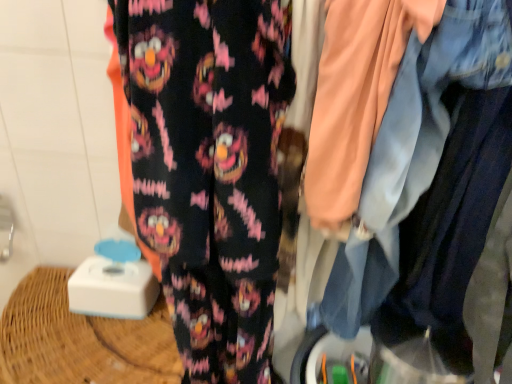
Locate an element on the screen. faded denim jacket at upper right is located at coordinates (413, 150).

What do you see at coordinates (413, 150) in the screenshot?
I see `faded denim jacket at upper right` at bounding box center [413, 150].

Identify the location of fluffy black pants at center. Image resolution: width=512 pixels, height=384 pixels. (209, 170).

What do you see at coordinates (209, 170) in the screenshot?
I see `fluffy black pants at center` at bounding box center [209, 170].

You are a GUI agent. You are given a task and a screenshot of the screen. Output one action in this format:
    pyautogui.click(x=<x>, y=<y>)
    Task: Click on the faded denim jacket at upper right
    Image resolution: width=512 pixels, height=384 pixels.
    Given the screenshot: What is the action you would take?
    pyautogui.click(x=413, y=150)

Considering the relative positions of fluffy black pants at center and faded denim jacket at upper right in the image provided, is fluffy black pants at center to the left of faded denim jacket at upper right from the viewer's perspective?

Yes.

Between fluffy black pants at center and faded denim jacket at upper right, which one is positioned in front?

faded denim jacket at upper right is closer to the camera.

Does point (190, 221) come behind point (393, 253)?

That is False.

In the scene shown: From the image's perspective, who appears lower, fluffy black pants at center or faded denim jacket at upper right?

fluffy black pants at center is shown below in the image.

From a real-world perspective, which is physically below, fluffy black pants at center or faded denim jacket at upper right?

fluffy black pants at center, from a real-world perspective.

Is fluffy black pants at center wider than faded denim jacket at upper right?

No.

In terms of height, does fluffy black pants at center look taller or shorter compared to faded denim jacket at upper right?

fluffy black pants at center is taller than faded denim jacket at upper right.

Is fluffy black pants at center bigger than faded denim jacket at upper right?

Result: No, fluffy black pants at center is not bigger than faded denim jacket at upper right.

Consider the image. Do you think fluffy black pants at center is within faded denim jacket at upper right, or outside of it?

The correct answer is: outside.

Is fluffy black pants at center not close to faded denim jacket at upper right?

fluffy black pants at center is near faded denim jacket at upper right, not far away.

Is fluffy black pants at center oriented towards faded denim jacket at upper right?

No, fluffy black pants at center is not aimed at faded denim jacket at upper right.

Locate an element on the screen. denim jacket above the fluffy black pants at center (from the image's perspective) is located at coordinates (413, 150).

Considering the relative positions of faded denim jacket at upper right and fluffy black pants at center in the image provided, is faded denim jacket at upper right to the left of fluffy black pants at center from the viewer's perspective?

In fact, faded denim jacket at upper right is to the right of fluffy black pants at center.

Between faded denim jacket at upper right and fluffy black pants at center, which one is positioned behind?

fluffy black pants at center is further away from the camera.

Which is closer, (327, 323) or (273, 27)?

Point (327, 323) is farther from the camera than point (273, 27).

From the image's perspective, which is below, faded denim jacket at upper right or fluffy black pants at center?

fluffy black pants at center is shown below in the image.

Consider the image. From a real-world perspective, which object stands above the other?

In real-world perspective, faded denim jacket at upper right is above.

Is faded denim jacket at upper right wider or thinner than fluffy black pants at center?

Clearly, faded denim jacket at upper right has more width compared to fluffy black pants at center.

Is faded denim jacket at upper right taller or shorter than fluffy black pants at center?

Clearly, faded denim jacket at upper right is shorter compared to fluffy black pants at center.

Which of these two, faded denim jacket at upper right or fluffy black pants at center, is smaller?

fluffy black pants at center is smaller.

Choose the correct answer: Is faded denim jacket at upper right inside fluffy black pants at center or outside it?

faded denim jacket at upper right exists outside the volume of fluffy black pants at center.

Is faded denim jacket at upper right positioned far away from fluffy black pants at center?

Actually, faded denim jacket at upper right and fluffy black pants at center are a little close together.

Is faded denim jacket at upper right aimed at fluffy black pants at center?

No, faded denim jacket at upper right is not turned towards fluffy black pants at center.

Can you tell me how much faded denim jacket at upper right and fluffy black pants at center differ in facing direction?

0.000321 degrees separate the facing orientations of faded denim jacket at upper right and fluffy black pants at center.

Locate an element on the screen. This screenshot has height=384, width=512. denim jacket in front of the fluffy black pants at center is located at coordinates (413, 150).

Where is `denim jacket above the fluffy black pants at center (from the image's perspective)`? The image size is (512, 384). denim jacket above the fluffy black pants at center (from the image's perspective) is located at coordinates (413, 150).

Locate an element on the screen. denim jacket on the right of fluffy black pants at center is located at coordinates (413, 150).